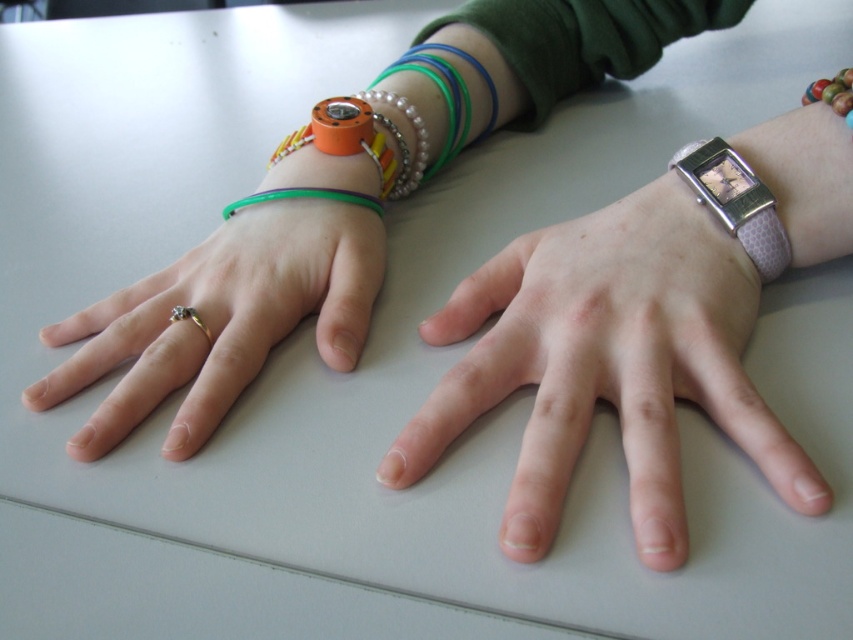
Question: Is gold metallic ring at left smaller than pink leather watch at right?

Choices:
 (A) no
 (B) yes

Answer: (A)

Question: Which point appears closest to the camera in this image?

Choices:
 (A) (128, 400)
 (B) (231, 205)
 (C) (740, 225)

Answer: (A)

Question: Estimate the real-world distances between objects in this image. Which object is closer to the gold metallic ring at left?

Choices:
 (A) pink leather watch at right
 (B) green rubber bracelet at left

Answer: (B)

Question: Estimate the real-world distances between objects in this image. Which object is farther from the white matte watch at right?

Choices:
 (A) green rubber bracelet at left
 (B) pink leather watch at right
 (C) gold metallic ring at left

Answer: (A)

Question: Is white matte watch at right thinner than pink leather watch at right?

Choices:
 (A) no
 (B) yes

Answer: (A)

Question: Considering the relative positions of gold metallic ring at left and pink leather watch at right in the image provided, where is gold metallic ring at left located with respect to pink leather watch at right?

Choices:
 (A) below
 (B) above

Answer: (A)